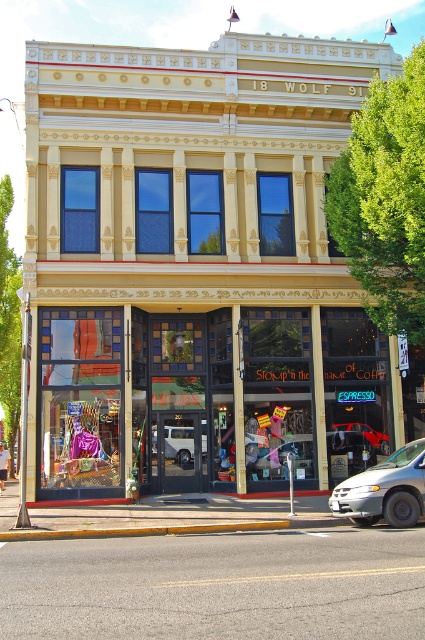
Is the position of translucent glass window at center more distant than that of white matte van at center?

No, translucent glass window at center is in front of white matte van at center.

Between point (215, 320) and point (187, 436), which one is positioned in front?

Point (215, 320) is more forward.

You are a GUI agent. You are given a task and a screenshot of the screen. Output one action in this format:
    pyautogui.click(x=<x>, y=<y>)
    Task: Click on the translucent glass window at center
    
    Given the screenshot: What is the action you would take?
    pyautogui.click(x=212, y=397)

Can you confirm if matte glass storefront at center is positioned above white matte van at center?

Yes.

Which of these two, matte glass storefront at center or white matte van at center, stands shorter?

With less height is white matte van at center.

Describe the element at coordinates (200, 268) in the screenshot. I see `matte glass storefront at center` at that location.

Identify the location of matte glass storefront at center. (200, 268).

Does translucent glass window at center lie in front of white matte van at lower right?

No, translucent glass window at center is behind white matte van at lower right.

Is translucent glass window at center wider than white matte van at lower right?

Indeed, translucent glass window at center has a greater width compared to white matte van at lower right.

Where is `translucent glass window at center`? The image size is (425, 640). translucent glass window at center is located at coordinates (212, 397).